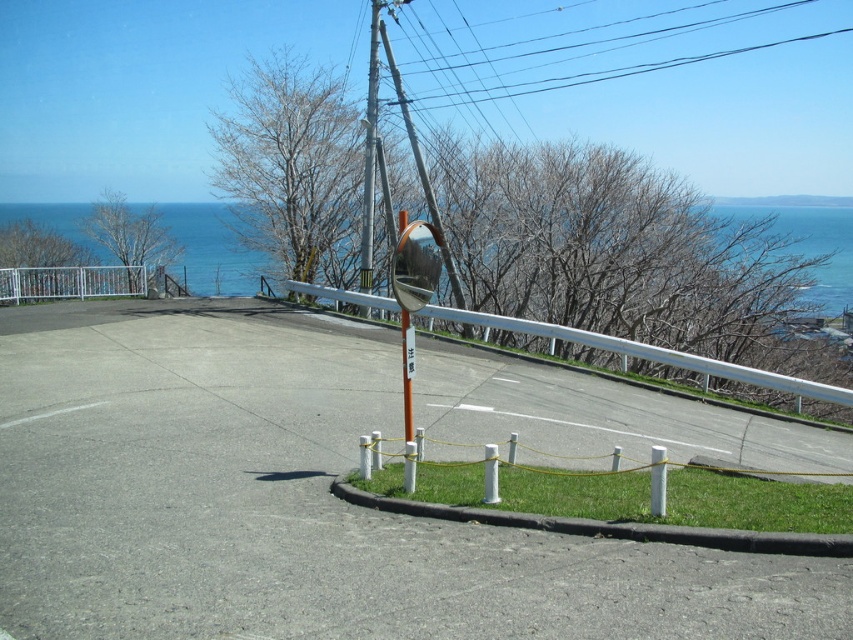
Measure the distance between blue water at upper center and camera.

blue water at upper center and camera are 24.49 meters apart.

Can you confirm if blue water at upper center is positioned to the left of white metal guardrail at center?

Correct, you'll find blue water at upper center to the left of white metal guardrail at center.

Which is in front, point (212, 285) or point (543, 332)?

Point (543, 332) is more forward.

Identify the location of blue water at upper center. This screenshot has width=853, height=640. 212,250.

Who is taller, black wire at upper center or metallic pole at center?

black wire at upper center is taller.

Can you confirm if black wire at upper center is thinner than metallic pole at center?

No, black wire at upper center is not thinner than metallic pole at center.

Where is `black wire at upper center`? Image resolution: width=853 pixels, height=640 pixels. black wire at upper center is located at coordinates (589, 74).

Looking at this image, is white metal guardrail at center wider than metallic gray pole at center?

Yes.

Between white metal guardrail at center and metallic gray pole at center, which one is positioned lower?

Positioned lower is white metal guardrail at center.

Locate an element on the screen. white metal guardrail at center is located at coordinates (646, 353).

You are a GUI agent. You are given a task and a screenshot of the screen. Output one action in this format:
    pyautogui.click(x=<x>, y=<y>)
    Task: Click on the white metal guardrail at center
    
    Given the screenshot: What is the action you would take?
    pyautogui.click(x=646, y=353)